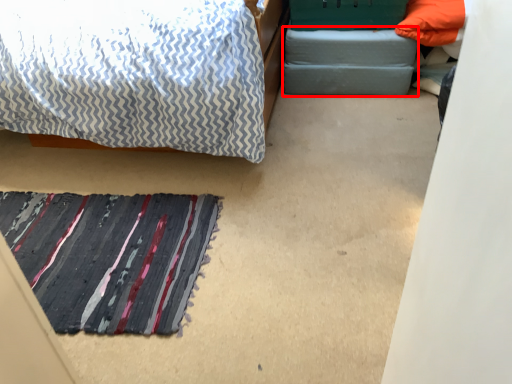
Question: Where is footrest (annotated by the red box) located in relation to mat in the image?

Choices:
 (A) right
 (B) left

Answer: (A)